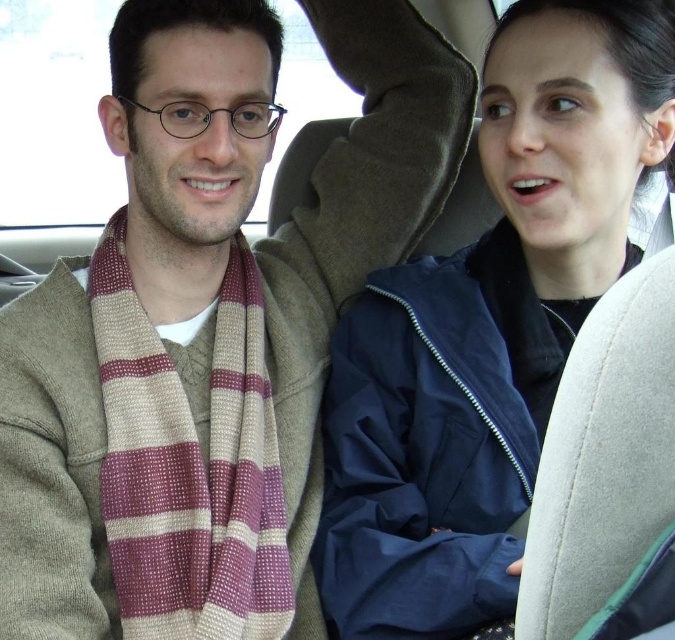
Question: Is striped wool scarf at left to the left of navy blue jacket at upper right from the viewer's perspective?

Choices:
 (A) no
 (B) yes

Answer: (B)

Question: Does striped wool scarf at left appear on the left side of navy blue jacket at upper right?

Choices:
 (A) yes
 (B) no

Answer: (A)

Question: Where is striped wool scarf at left located in relation to navy blue jacket at upper right in the image?

Choices:
 (A) right
 (B) left

Answer: (B)

Question: Which point appears farthest from the camera in this image?

Choices:
 (A) pyautogui.click(x=88, y=352)
 (B) pyautogui.click(x=432, y=592)

Answer: (A)